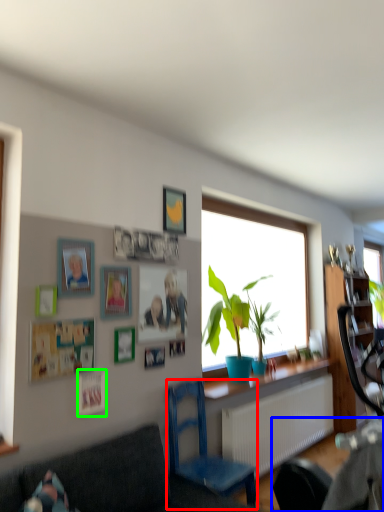
Question: Estimate the real-world distances between objects in this image. Which object is farther from chair (highlighted by a red box), rocking chair (highlighted by a blue box) or picture frame (highlighted by a green box)?

Choices:
 (A) rocking chair
 (B) picture frame

Answer: (B)